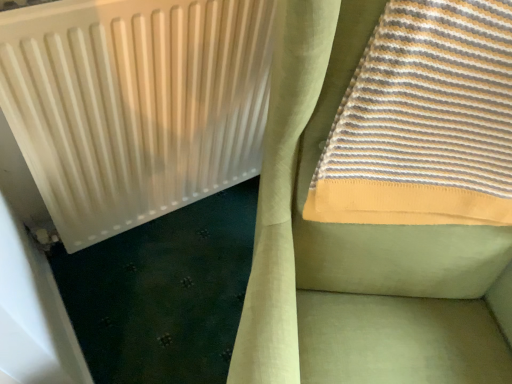
Question: From a real-world perspective, is white matte radiator at upper left positioned over striped cotton towel at upper right based on gravity?

Choices:
 (A) no
 (B) yes

Answer: (A)

Question: From the image's perspective, is white matte radiator at upper left located above striped cotton towel at upper right?

Choices:
 (A) no
 (B) yes

Answer: (A)

Question: From a real-world perspective, does white matte radiator at upper left sit lower than striped cotton towel at upper right?

Choices:
 (A) yes
 (B) no

Answer: (A)

Question: Does white matte radiator at upper left have a larger size compared to striped cotton towel at upper right?

Choices:
 (A) yes
 (B) no

Answer: (B)

Question: Considering the relative sizes of white matte radiator at upper left and striped cotton towel at upper right in the image provided, is white matte radiator at upper left wider than striped cotton towel at upper right?

Choices:
 (A) yes
 (B) no

Answer: (B)

Question: Considering the relative sizes of white matte radiator at upper left and striped cotton towel at upper right in the image provided, is white matte radiator at upper left shorter than striped cotton towel at upper right?

Choices:
 (A) yes
 (B) no

Answer: (B)

Question: From a real-world perspective, is striped cotton towel at upper right located beneath white matte radiator at upper left?

Choices:
 (A) yes
 (B) no

Answer: (B)

Question: Is striped cotton towel at upper right in contact with white matte radiator at upper left?

Choices:
 (A) no
 (B) yes

Answer: (A)

Question: Can you confirm if striped cotton towel at upper right is shorter than white matte radiator at upper left?

Choices:
 (A) no
 (B) yes

Answer: (B)

Question: From the image's perspective, is striped cotton towel at upper right above white matte radiator at upper left?

Choices:
 (A) no
 (B) yes

Answer: (B)

Question: From a real-world perspective, is striped cotton towel at upper right positioned over white matte radiator at upper left based on gravity?

Choices:
 (A) no
 (B) yes

Answer: (B)

Question: Considering the relative sizes of striped cotton towel at upper right and white matte radiator at upper left in the image provided, is striped cotton towel at upper right thinner than white matte radiator at upper left?

Choices:
 (A) no
 (B) yes

Answer: (A)

Question: In terms of size, does striped cotton towel at upper right appear bigger or smaller than white matte radiator at upper left?

Choices:
 (A) big
 (B) small

Answer: (A)